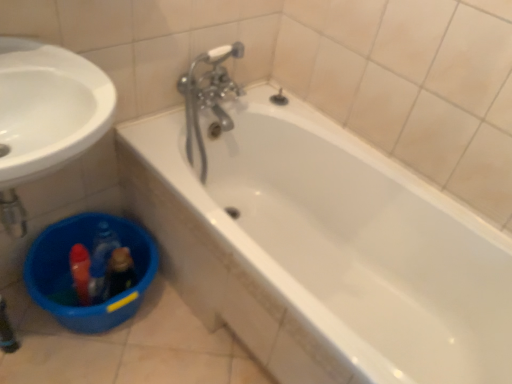
Find the location of a particular element. translucent plastic bottle at lower left is located at coordinates [x=120, y=272].

The image size is (512, 384). Describe the element at coordinates (120, 272) in the screenshot. I see `translucent plastic bottle at lower left` at that location.

Identify the location of translucent plastic bottle at lower left. (120, 272).